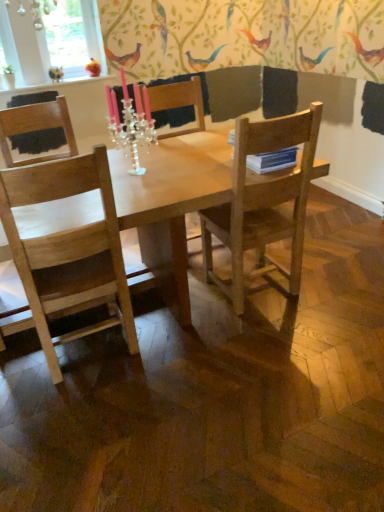
Where is `free location in front of crystal clear candle holder at center`? This screenshot has width=384, height=512. free location in front of crystal clear candle holder at center is located at coordinates (142, 187).